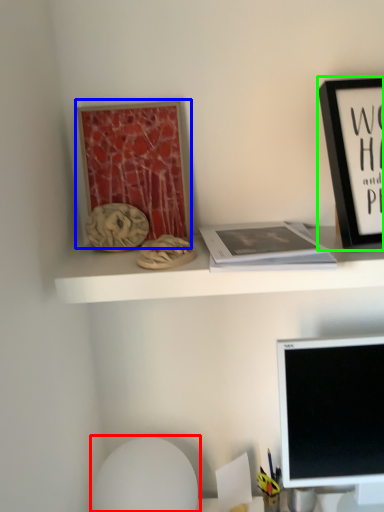
Question: Estimate the real-world distances between objects in this image. Which object is farther from swivel chair (highlighted by a red box), bulletin board (highlighted by a blue box) or picture frame (highlighted by a green box)?

Choices:
 (A) bulletin board
 (B) picture frame

Answer: (B)